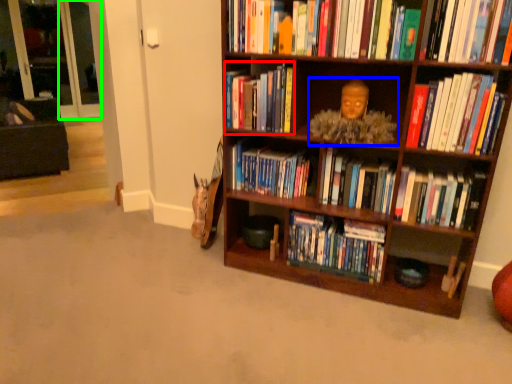
Question: Which object is the closest to the book (highlighted by a red box)? Choose among these: person (highlighted by a blue box) or glass door (highlighted by a green box).

Choices:
 (A) person
 (B) glass door

Answer: (A)